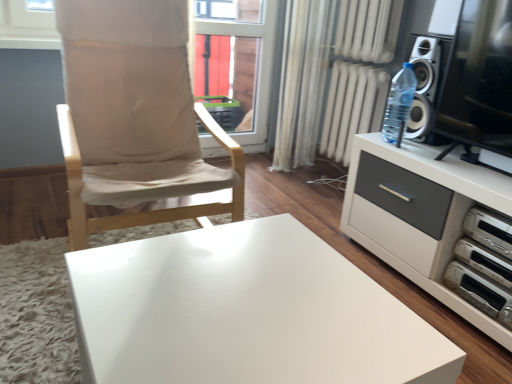
Question: Considering the positions of point (x=480, y=253) and point (x=257, y=147), is point (x=480, y=253) closer or farther from the camera than point (x=257, y=147)?

Choices:
 (A) farther
 (B) closer

Answer: (B)

Question: Considering their positions, is white plastic stereo at lower right located in front of or behind transparent glass window at center?

Choices:
 (A) behind
 (B) front

Answer: (B)

Question: Estimate the real-world distances between objects in this image. Which object is closer to the white plastic stereo at lower right?

Choices:
 (A) beige fabric chair at left
 (B) white sheer curtain at center
 (C) transparent glass window at center
 (D) transparent glass screen door at right
 (E) white plastic dvd player at lower right, placed as the 2th appliance when sorted from top to bottom

Answer: (E)

Question: Estimate the real-world distances between objects in this image. Which object is closer to the white plastic dvd player at right, which is the 1th appliance from top to bottom?

Choices:
 (A) white sheer curtain at center
 (B) transparent glass screen door at right
 (C) white glossy table at center
 (D) beige fabric chair at left
 (E) white plastic stereo at lower right

Answer: (E)